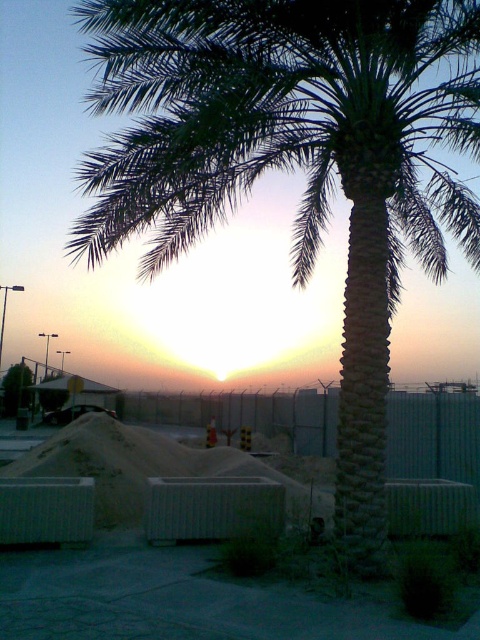
Question: Among these objects, which one is farthest from the camera?

Choices:
 (A) green leafy palm at center
 (B) white concrete mound at center

Answer: (A)

Question: Is the position of white concrete mound at center more distant than that of green leafy palm at center?

Choices:
 (A) no
 (B) yes

Answer: (A)

Question: Does white concrete mound at center have a larger size compared to green leafy palm at center?

Choices:
 (A) yes
 (B) no

Answer: (A)

Question: Which point is closer to the camera taking this photo?

Choices:
 (A) pyautogui.click(x=176, y=467)
 (B) pyautogui.click(x=19, y=396)

Answer: (A)

Question: Can you confirm if white concrete mound at center is positioned to the right of green leafy palm at center?

Choices:
 (A) yes
 (B) no

Answer: (A)